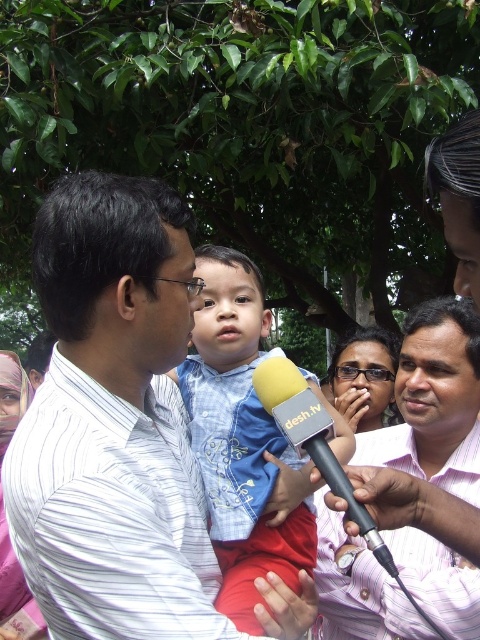
Question: Is blue plaid shirt at center thinner than matte black glasses at center?

Choices:
 (A) no
 (B) yes

Answer: (A)

Question: Can you confirm if white striped shirt at center is positioned to the left of matte black glasses at center?

Choices:
 (A) yes
 (B) no

Answer: (A)

Question: Does pink striped shirt at center have a larger size compared to blue plaid shirt at center?

Choices:
 (A) no
 (B) yes

Answer: (B)

Question: Which object is closer to the camera taking this photo?

Choices:
 (A) pink striped shirt at center
 (B) blue plaid shirt at center
 (C) matte black glasses at center

Answer: (B)

Question: Which object is positioned farthest from the blue plaid shirt at center?

Choices:
 (A) pink striped shirt at center
 (B) yellow foam microphone at center
 (C) matte black glasses at center
 (D) white striped shirt at center

Answer: (C)

Question: Which is farther from the blue plaid shirt at center?

Choices:
 (A) pink striped shirt at center
 (B) matte black glasses at center
 (C) yellow foam microphone at center

Answer: (B)